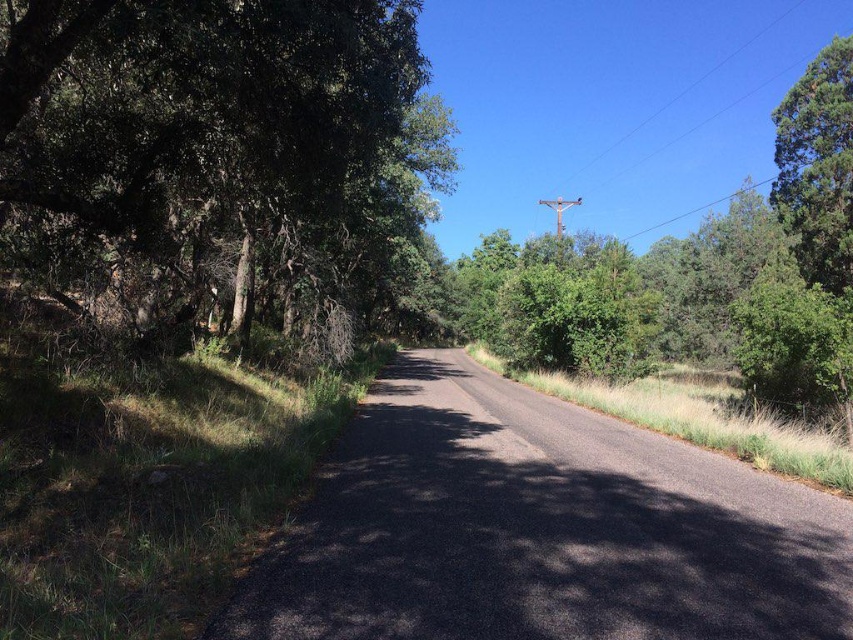
You are driving a car that is 2 meters wide. You need to navigate through the scene depicted in the image. Considering the black asphalt road at center and the green leafy tree at left, can your car safely pass through the road without hitting the tree?

The black asphalt road at center has a width larger than the green leafy tree at left. Since the road is wider than the tree, the car can safely pass through the road without hitting the tree as long as it stays within the road.

You are standing at the center of the road and want to walk towards the green leafy tree at left. Which direction should you face to walk directly towards it?

The green leafy tree at left is located at coordinates 0.214 on the x axis and 0.254 on the y axis. Since you are at the center of the road, you should face towards the left direction to walk directly towards the green leafy tree at left.